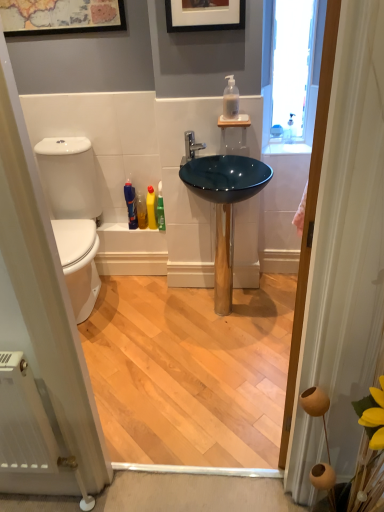
This screenshot has height=512, width=384. Find the location of `free space to the left of translucent plastic bottles at lower center, which is counted as the first toiletry, starting from the left`. free space to the left of translucent plastic bottles at lower center, which is counted as the first toiletry, starting from the left is located at coordinates (121, 224).